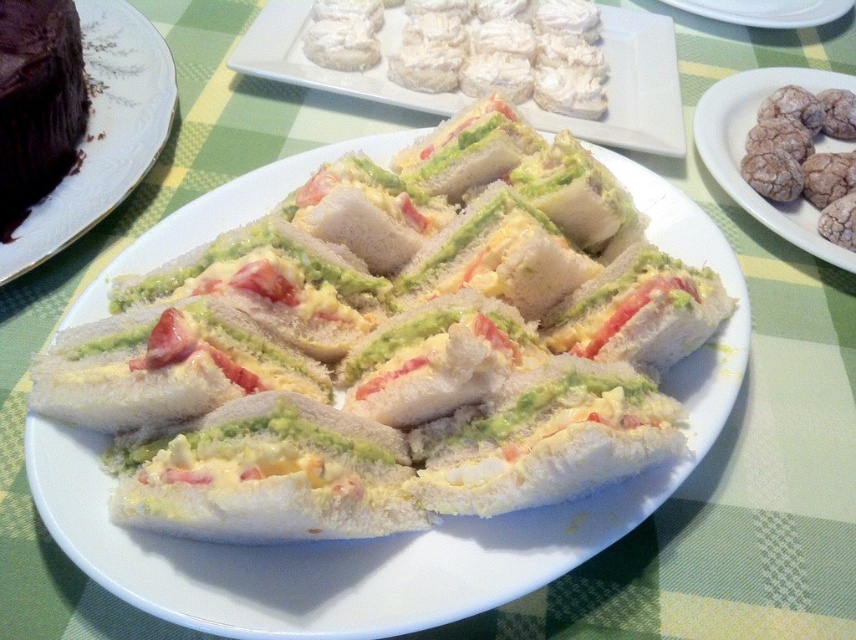
Question: Considering the relative positions of white bread sandwiches at center and chocolate matte cake at upper left in the image provided, where is white bread sandwiches at center located with respect to chocolate matte cake at upper left?

Choices:
 (A) left
 (B) right

Answer: (B)

Question: Which is farther from the white cream cheese sandwiches at center?

Choices:
 (A) chocolate cake at upper left
 (B) brown crumbly cookies at right

Answer: (A)

Question: Considering the relative positions of white bread sandwiches at center and chocolate cake at upper left in the image provided, where is white bread sandwiches at center located with respect to chocolate cake at upper left?

Choices:
 (A) below
 (B) above

Answer: (A)

Question: Which object is positioned farthest from the chocolate cake at upper left?

Choices:
 (A) white cream cheese sandwiches at center
 (B) white bread sandwiches at center

Answer: (A)

Question: Is white cream cheese sandwiches at center below chocolate matte cake at upper left?

Choices:
 (A) yes
 (B) no

Answer: (B)

Question: Considering the real-world distances, which object is closest to the white cream cheese sandwiches at center?

Choices:
 (A) white ceramic plate at center
 (B) chocolate matte cake at upper left
 (C) chocolate cake at upper left
 (D) brown crumbly cookies at right

Answer: (D)